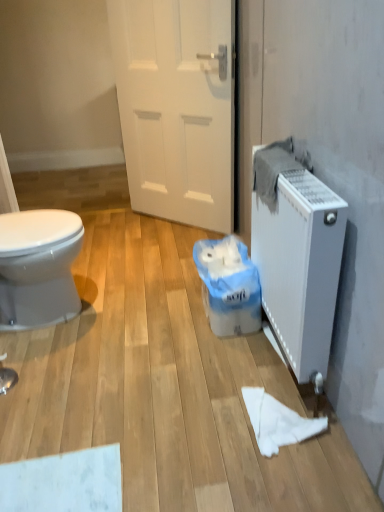
The image size is (384, 512). Find the location of `vacant area that lies between white plastic bag at center and white matte radiator at right`. vacant area that lies between white plastic bag at center and white matte radiator at right is located at coordinates (243, 359).